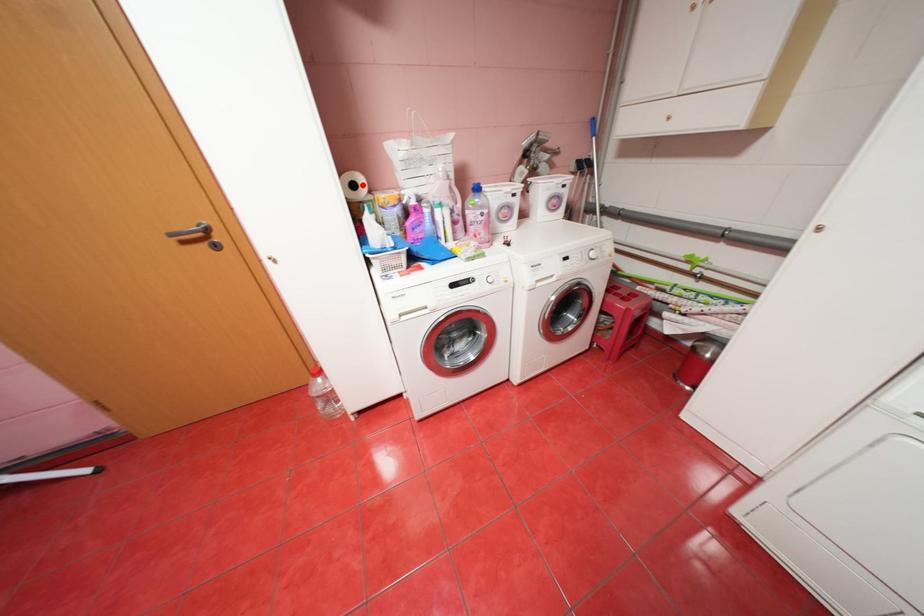
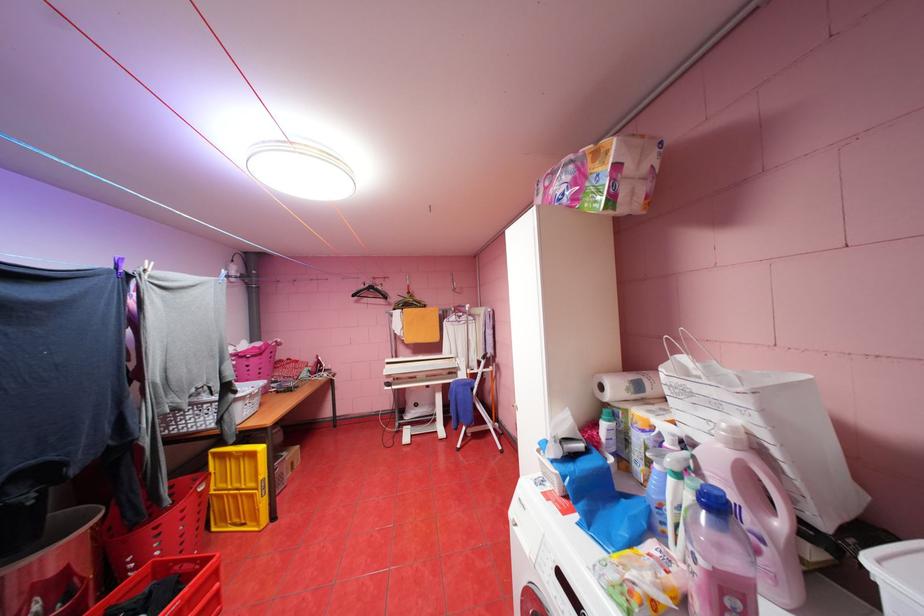
The point at the highlighted location is marked in the first image. Where is the corresponding point in the second image?

(610, 387)